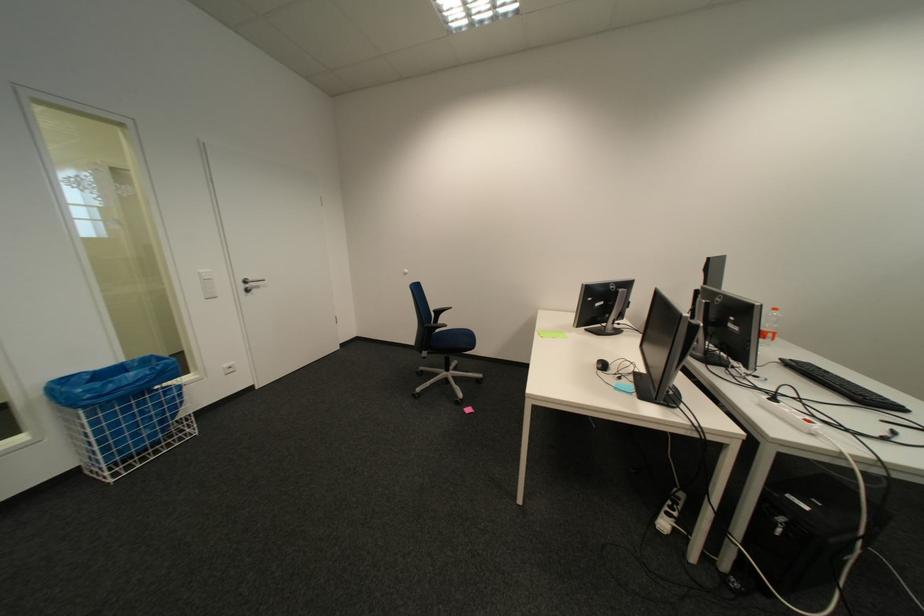
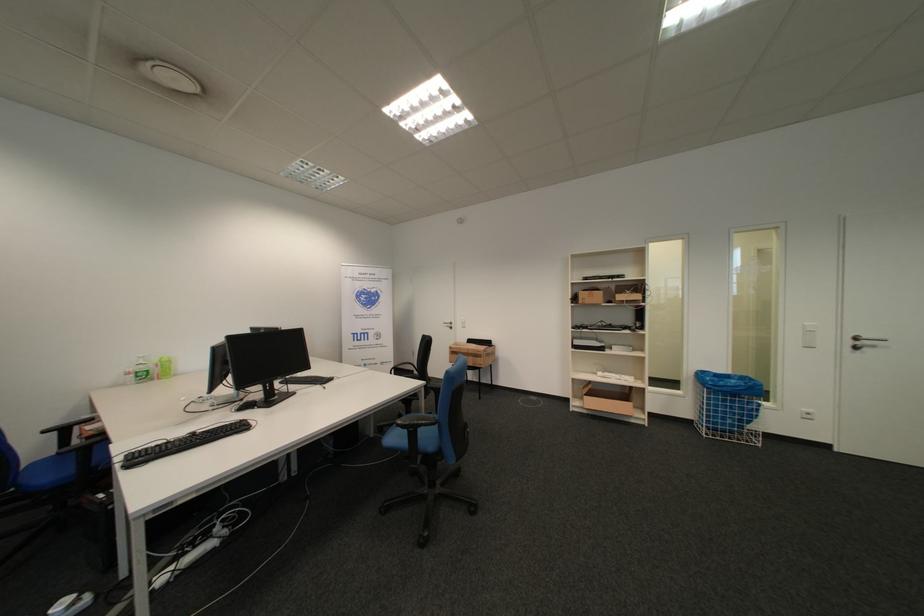
The point at (x=254, y=286) is marked in the first image. Where is the corresponding point in the second image?

(862, 344)